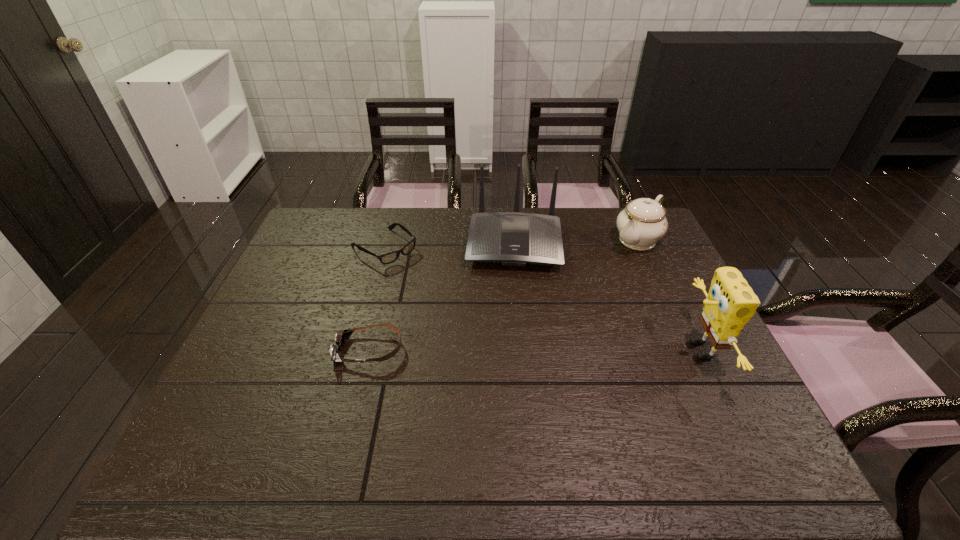
Locate an element on the screen. The width and height of the screenshot is (960, 540). the second closest object relative to the spectacles is located at coordinates (341, 338).

This screenshot has width=960, height=540. I want to click on object that ranks as the second closest to the goggles, so click(x=512, y=238).

Identify the location of free space that satisfies the following two spatial constraints: 1. on the front side of the spectacles; 2. on the front-facing side of the goggles. (357, 350).

Identify the location of vacant position in the image that satisfies the following two spatial constraints: 1. on the back side of the router; 2. on the right side of the chinaware. (514, 240).

Locate an element on the screen. free space that satisfies the following two spatial constraints: 1. on the back side of the third shortest object; 2. on the right side of the third object from right to left is located at coordinates (514, 240).